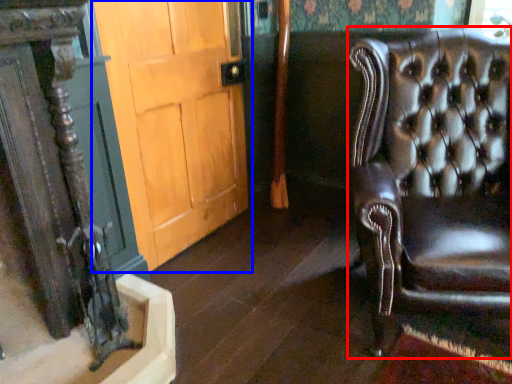
Question: Which point is closer to the camera, chair (highlighted by a red box) or door (highlighted by a blue box)?

Choices:
 (A) chair
 (B) door

Answer: (A)